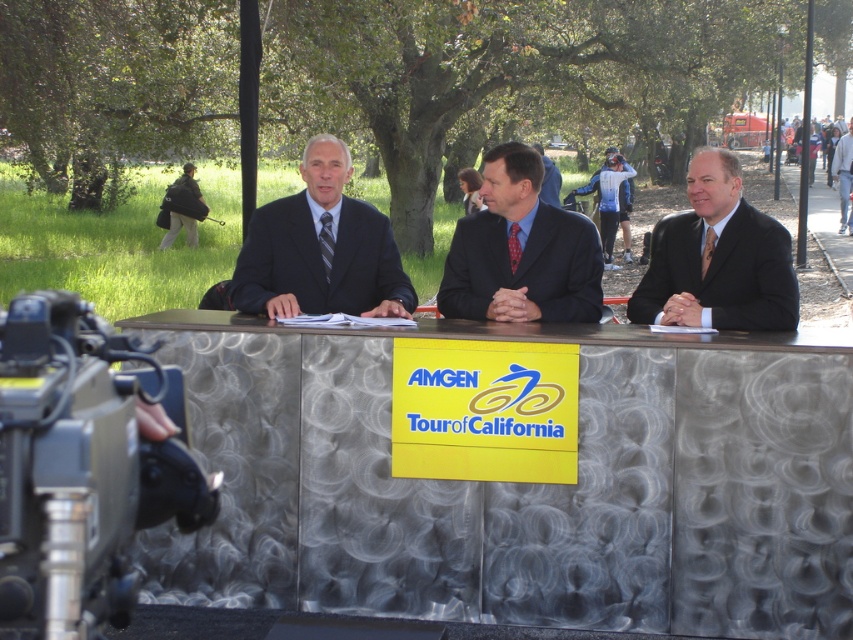
You are a camera operator adjusting the focus of your lens. There is a point at coordinates point (320, 248) that you need to focus on. What object is located at this point?

The object at point (320, 248) is the matte black suit at center.

You are a camera operator trying to focus on the person wearing the matte black suit at center and the dark suit at center. Which one is on the left side?

The matte black suit at center is positioned on the left side of dark suit at center.